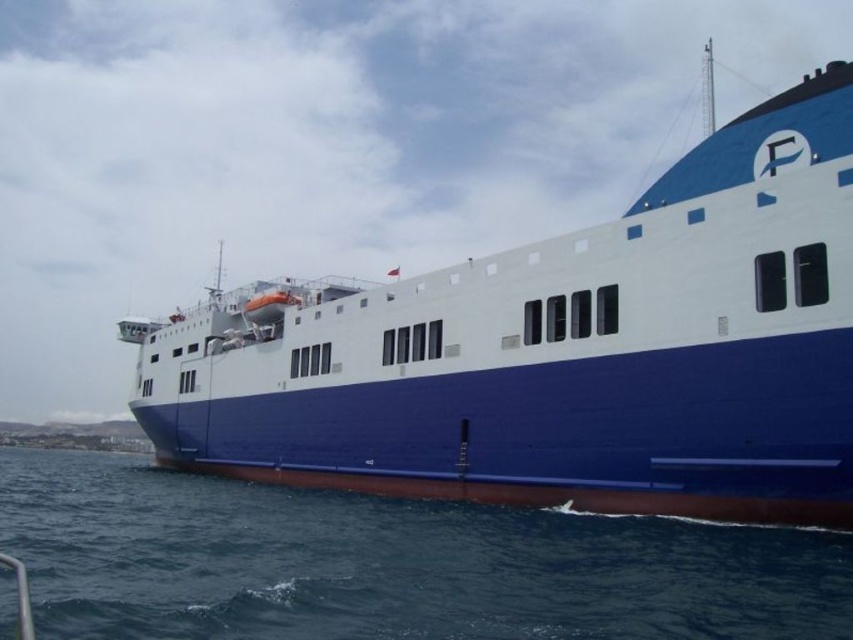
You are standing on the deck of the ferry and see a point marked at coordinates [561,352]. Based on the scene description, where is this point located?

The point at [561,352] is on the blue matte ship at center.

You are an observer standing on the shore looking at the image. Which object, the blue matte ship at center or the blue smooth water at lower center, would appear larger in the scene?

The blue matte ship at center appears larger than the blue smooth water at lower center in the scene.

You are a passenger on the ferry and want to take a photo of the blue smooth water at lower center without the blue matte ship at center blocking the view. Is there a position on the ferry where you can do this?

The blue matte ship at center is above the blue smooth water at lower center, so if you move to a position below the ship, such as the lower deck or behind the ship, you can capture the blue smooth water at lower center without the ship blocking the view.